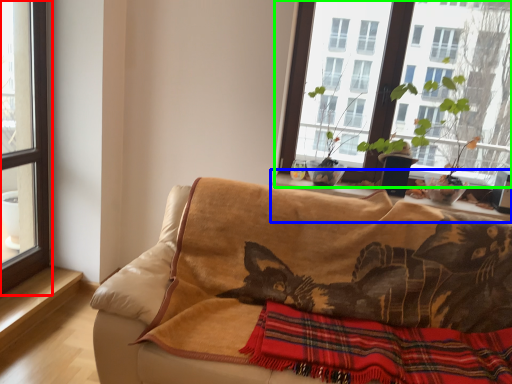
Question: Based on their relative distances, which object is nearer to window (highlighted by a red box)? Choose from window sill (highlighted by a blue box) and window (highlighted by a green box).

Choices:
 (A) window sill
 (B) window

Answer: (A)